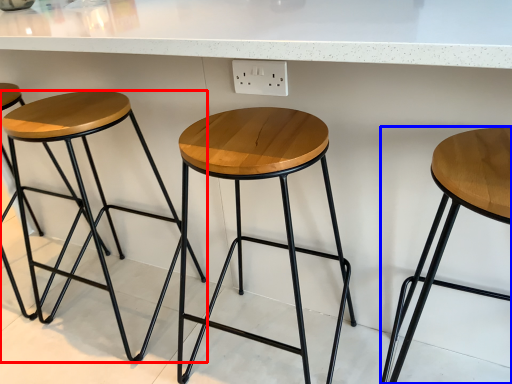
Question: Among these objects, which one is nearest to the camera, stool (highlighted by a red box) or stool (highlighted by a blue box)?

Choices:
 (A) stool
 (B) stool

Answer: (B)